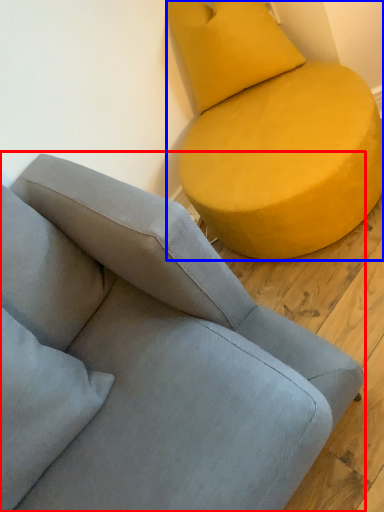
Question: Which object appears closest to the camera in this image, studio couch (highlighted by a red box) or studio couch (highlighted by a blue box)?

Choices:
 (A) studio couch
 (B) studio couch

Answer: (A)